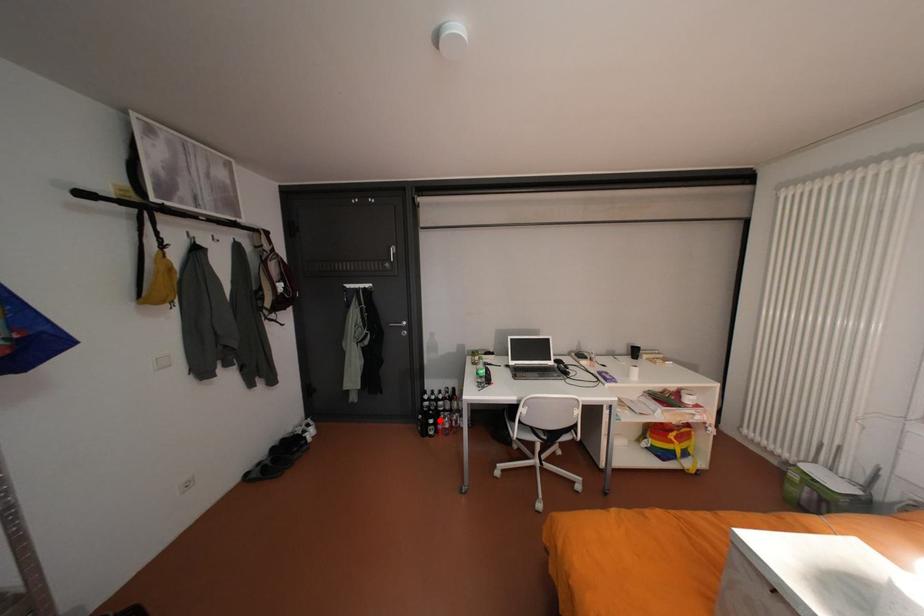
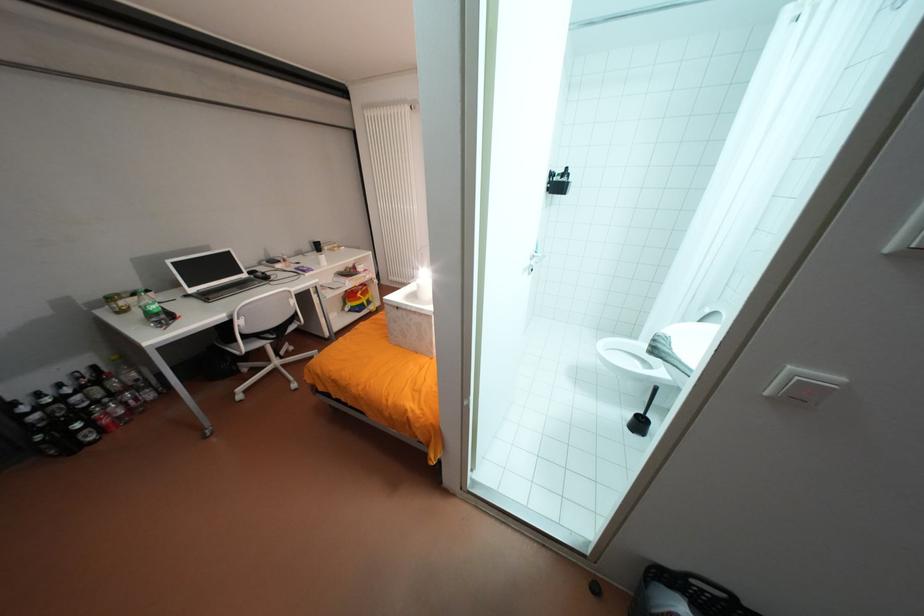
Locate, in the second image, the point that corresponds to the highlighted location in the first image.

(88, 424)